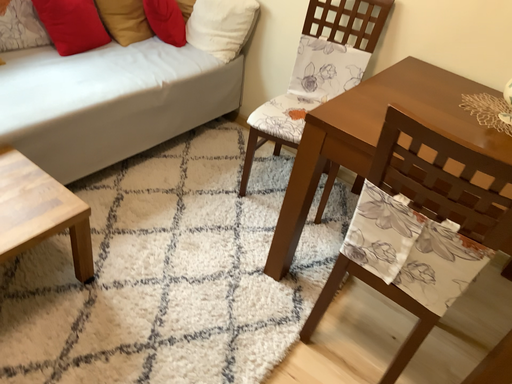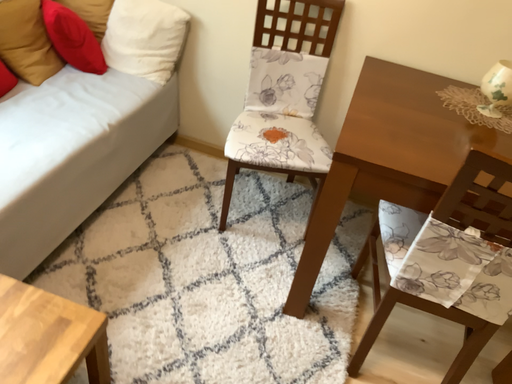
Question: How did the camera likely rotate when shooting the video?

Choices:
 (A) rotated left
 (B) rotated right

Answer: (B)